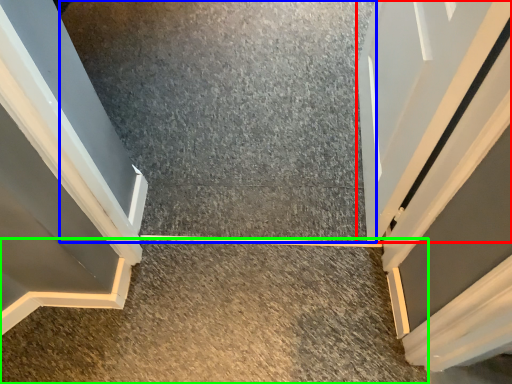
Question: Which object is positioned closest to door (highlighted by a red box)? Select from concrete (highlighted by a blue box) and concrete (highlighted by a green box).

Choices:
 (A) concrete
 (B) concrete

Answer: (A)